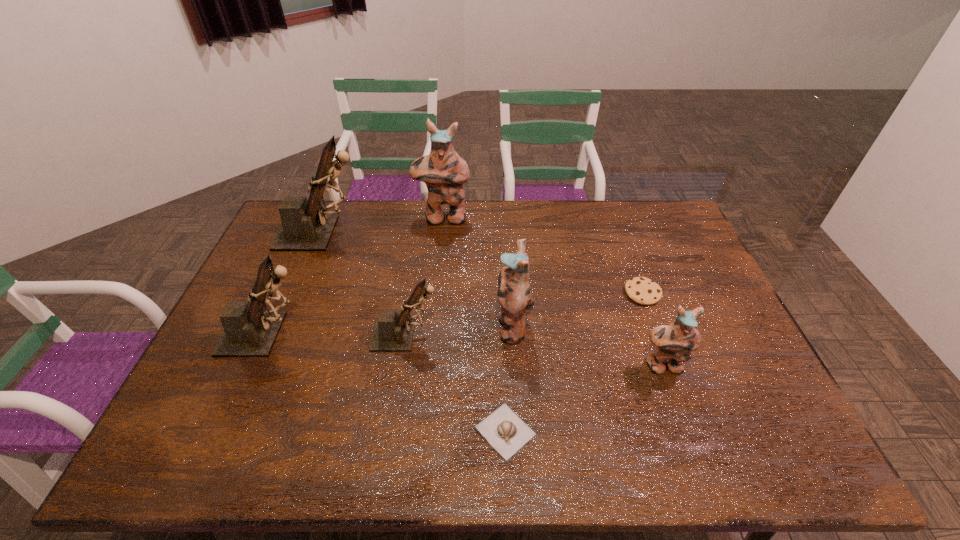
Where is `the farthest pink figurine`? the farthest pink figurine is located at coordinates (444, 172).

You are a GUI agent. You are given a task and a screenshot of the screen. Output one action in this format:
    pyautogui.click(x=<x>, y=<y>)
    Task: Click on the leftmost pink figurine
    This screenshot has width=960, height=540.
    Given the screenshot: What is the action you would take?
    pyautogui.click(x=444, y=172)

Find the location of `the biggest brown figurine`. the biggest brown figurine is located at coordinates (305, 226).

This screenshot has height=540, width=960. In order to click on the second smallest brown figurine in this screenshot , I will do `click(250, 329)`.

Identify the location of the fifth figurine from left to right. Image resolution: width=960 pixels, height=540 pixels. (514, 292).

The width and height of the screenshot is (960, 540). I want to click on the second pink figurine from left to right, so click(514, 292).

At what (x,y) coordinates should I click in order to perform the action: click on the rightmost brown figurine. Please return your answer as a coordinate pair (x, y). Looking at the image, I should click on (392, 332).

I want to click on the rightmost figurine, so click(x=673, y=343).

Identify the location of the nearest pink figurine. Image resolution: width=960 pixels, height=540 pixels. (673, 343).

I want to click on cookie, so click(x=641, y=290).